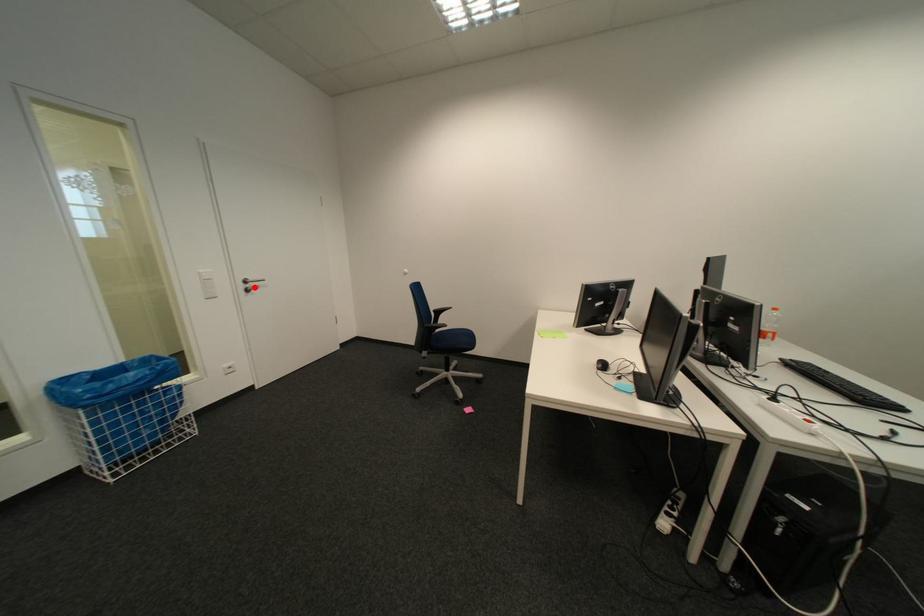
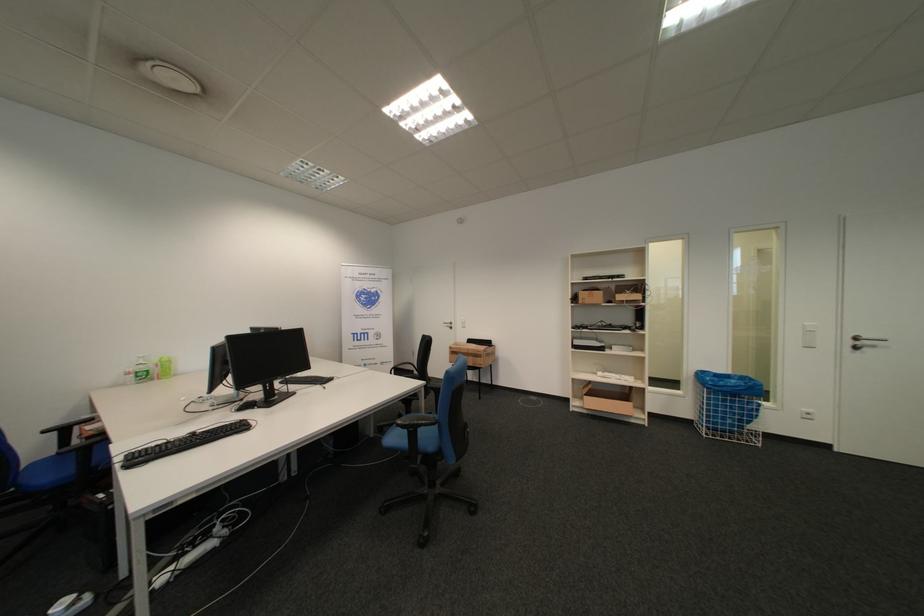
Where in the second image is the point corresponding to the highlighted location from the first image?

(862, 344)